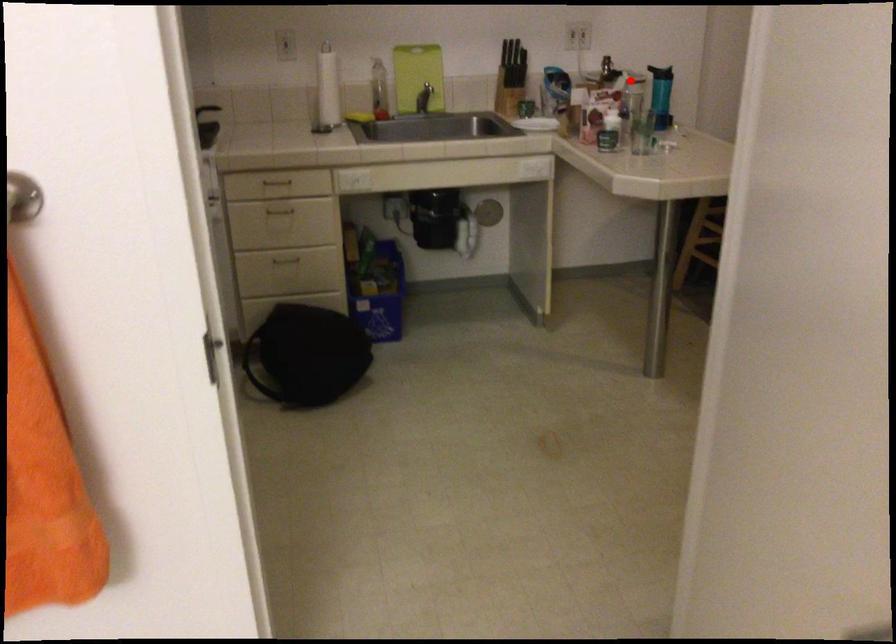
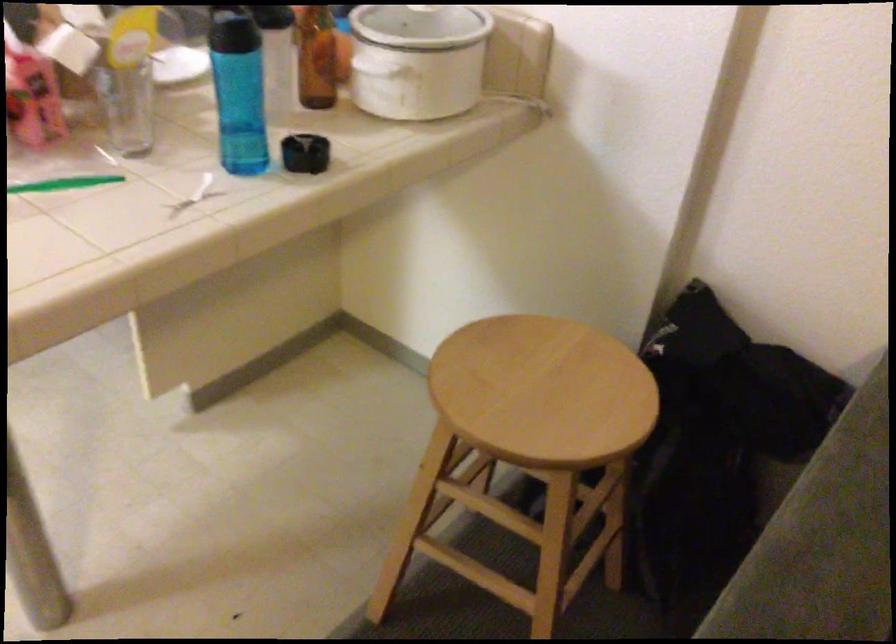
Question: I am providing you with two images of the same scene from different viewpoints. In image1, a red point is highlighted. Considering the same 3D point in image2, which of the following is correct?

Choices:
 (A) It is closer
 (B) It is farther

Answer: (A)